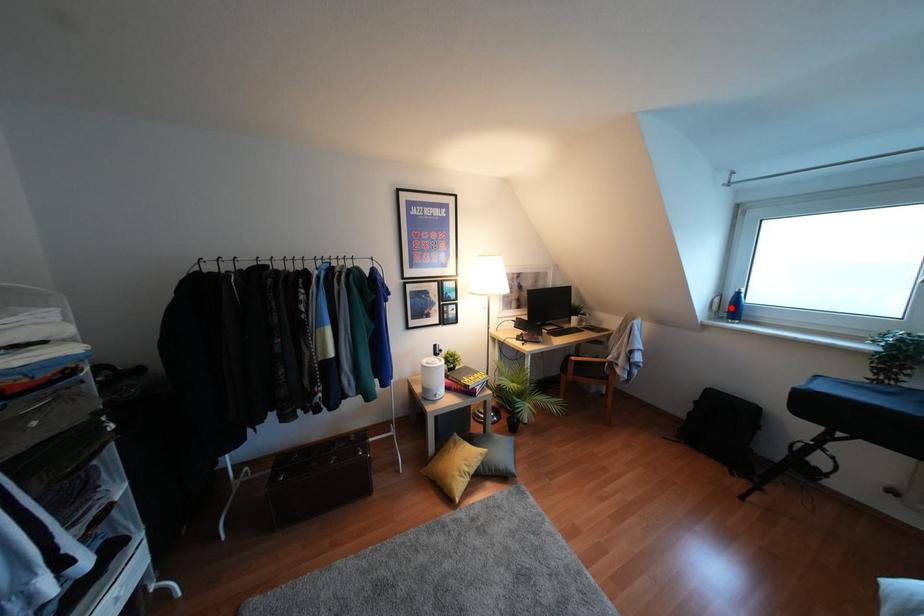
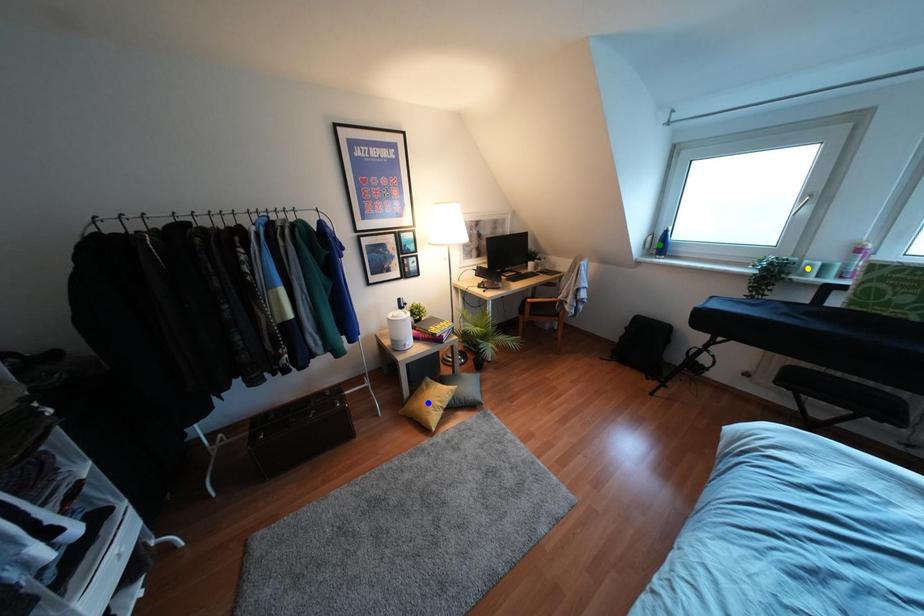
Question: I am providing you with two images of the same scene from different viewpoints. A red point is marked on the first image. You are given multiple points on the second image. Which point in image 2 represents the same 3d spot as the red point in image 1?

Choices:
 (A) blue point
 (B) green point
 (C) yellow point

Answer: (B)